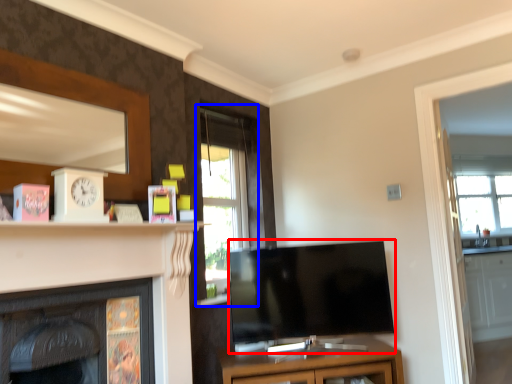
Question: Which object appears farthest to the camera in this image, television (highlighted by a red box) or window (highlighted by a blue box)?

Choices:
 (A) television
 (B) window

Answer: (B)